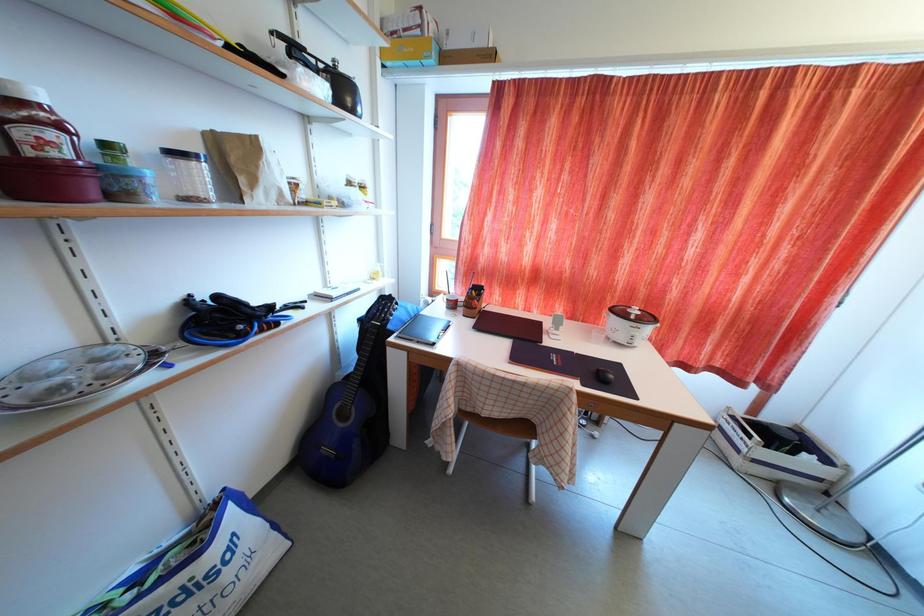
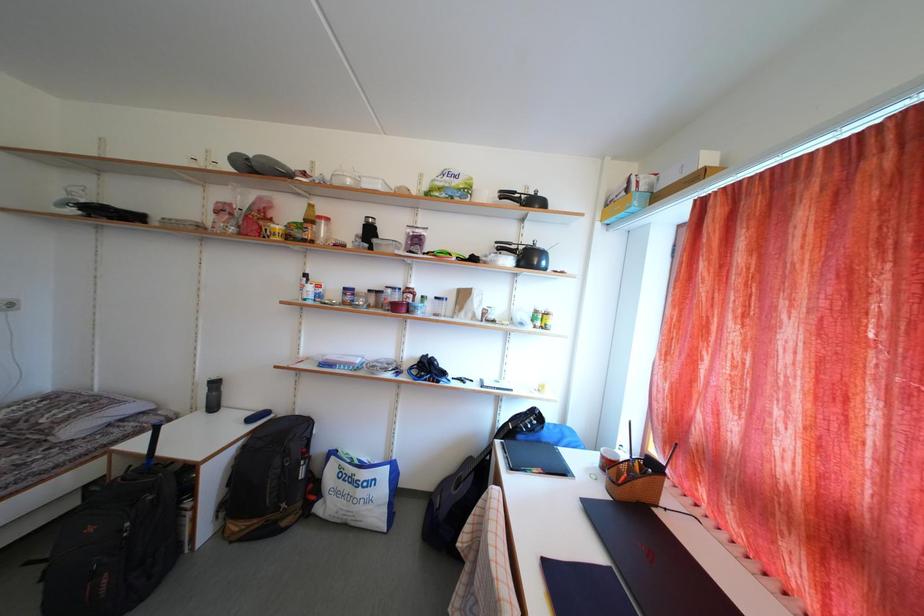
Question: The camera is either moving clockwise (left) or counter-clockwise (right) around the object. The first image is from the beginning of the video and the second image is from the end. Is the camera moving left or right when shooting the video?

Choices:
 (A) Left
 (B) Right

Answer: (B)